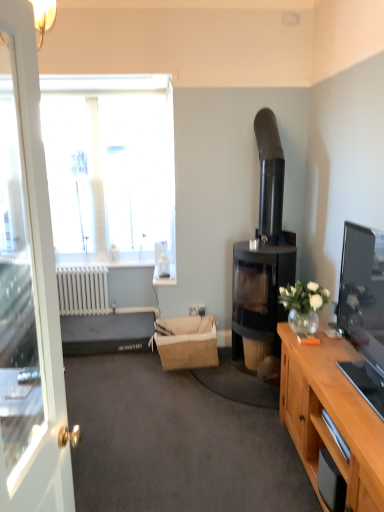
Question: Considering the relative positions of brown woven picnic basket at center and white plastic power outlet at center in the image provided, is brown woven picnic basket at center behind white plastic power outlet at center?

Choices:
 (A) yes
 (B) no

Answer: (B)

Question: Is brown woven picnic basket at center shorter than white plastic power outlet at center?

Choices:
 (A) no
 (B) yes

Answer: (A)

Question: Is brown woven picnic basket at center oriented towards white plastic power outlet at center?

Choices:
 (A) no
 (B) yes

Answer: (A)

Question: Is white plastic power outlet at center a part of brown woven picnic basket at center?

Choices:
 (A) yes
 (B) no

Answer: (A)

Question: Is brown woven picnic basket at center directly adjacent to white plastic power outlet at center?

Choices:
 (A) no
 (B) yes

Answer: (A)

Question: Is brown woven picnic basket at center closer to the viewer compared to white plastic power outlet at center?

Choices:
 (A) no
 (B) yes

Answer: (B)

Question: Is dark gray fabric bed at lower left inside brown woven picnic basket at center?

Choices:
 (A) no
 (B) yes

Answer: (A)

Question: Is brown woven picnic basket at center shorter than dark gray fabric bed at lower left?

Choices:
 (A) no
 (B) yes

Answer: (A)

Question: Can you confirm if brown woven picnic basket at center is positioned to the left of dark gray fabric bed at lower left?

Choices:
 (A) no
 (B) yes

Answer: (A)

Question: Is brown woven picnic basket at center with dark gray fabric bed at lower left?

Choices:
 (A) no
 (B) yes

Answer: (A)

Question: Is brown woven picnic basket at center oriented away from dark gray fabric bed at lower left?

Choices:
 (A) yes
 (B) no

Answer: (B)

Question: Is brown woven picnic basket at center taller than dark gray fabric bed at lower left?

Choices:
 (A) no
 (B) yes

Answer: (B)

Question: Is white plastic power outlet at center facing towards white glossy door at left?

Choices:
 (A) yes
 (B) no

Answer: (B)